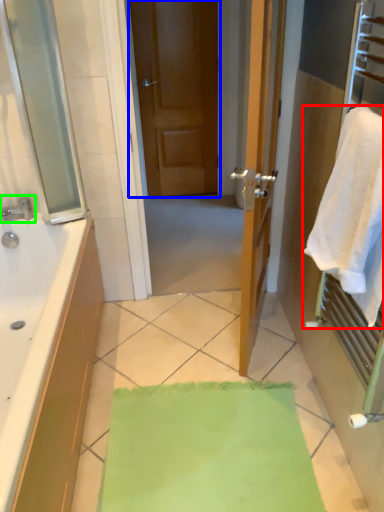
Question: Estimate the real-world distances between objects in this image. Which object is farther from towel (highlighted by a red box), door (highlighted by a blue box) or tap (highlighted by a green box)?

Choices:
 (A) door
 (B) tap

Answer: (A)